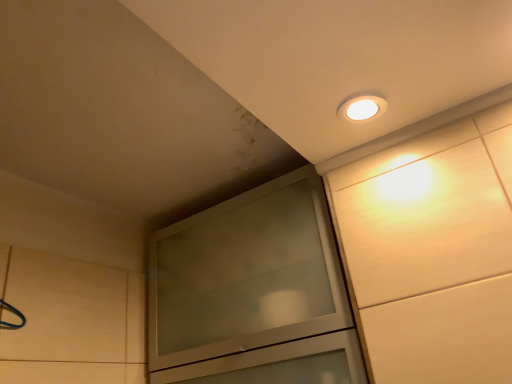
What do you see at coordinates (253, 292) in the screenshot?
I see `frosted glass cabinet at center` at bounding box center [253, 292].

At what (x,y) coordinates should I click in order to perform the action: click on frosted glass cabinet at center. Please return your answer as a coordinate pair (x, y). This screenshot has width=512, height=384. Looking at the image, I should click on (253, 292).

Locate an element on the screen. frosted glass cabinet at center is located at coordinates (253, 292).